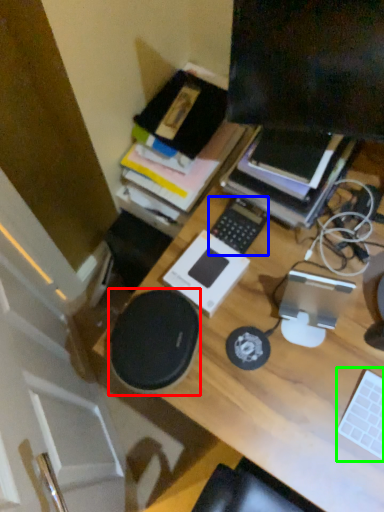
Question: Estimate the real-world distances between objects in this image. Which object is farther from speaker (highlighted by a red box), laptop keyboard (highlighted by a blue box) or laptop keyboard (highlighted by a green box)?

Choices:
 (A) laptop keyboard
 (B) laptop keyboard

Answer: (B)